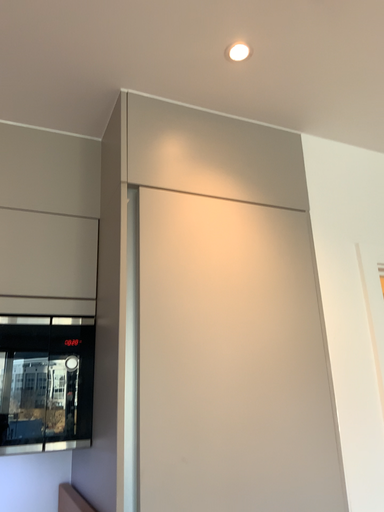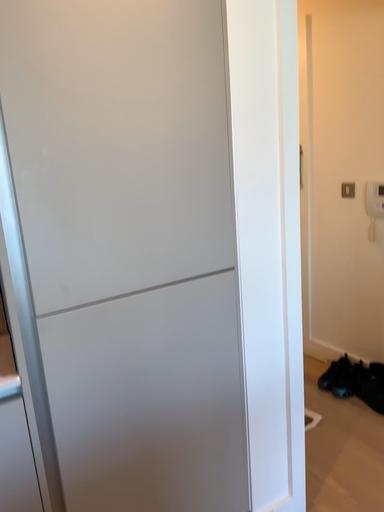
Question: How did the camera likely rotate when shooting the video?

Choices:
 (A) rotated upward
 (B) rotated downward

Answer: (B)